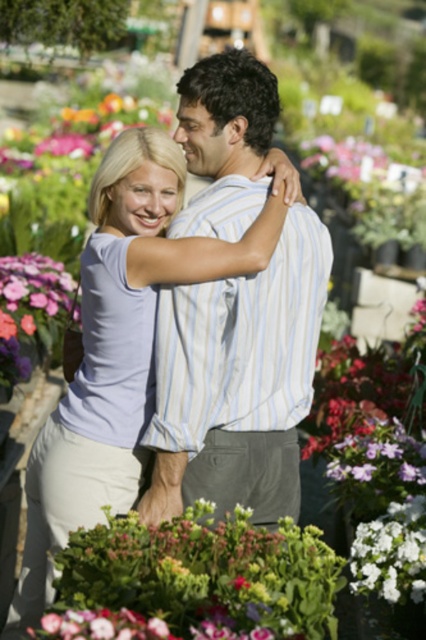
Question: Which object is closer to the camera taking this photo?

Choices:
 (A) light purple cotton shirt at center
 (B) green leafy plant at center
 (C) pink matte flower at center
 (D) white matte flower at center

Answer: (C)

Question: Which of the following is the farthest from the observer?

Choices:
 (A) (373, 580)
 (B) (221, 243)
 (C) (310, 307)
 (D) (149, 618)

Answer: (C)

Question: Considering the relative positions of striped cotton shirt at center and pink matte flower at lower left in the image provided, where is striped cotton shirt at center located with respect to pink matte flower at lower left?

Choices:
 (A) above
 (B) below

Answer: (A)

Question: From the image, what is the correct spatial relationship of striped cotton shirt at center in relation to pink matte flower at lower left?

Choices:
 (A) left
 (B) right

Answer: (B)

Question: Which of the following is the farthest from the observer?

Choices:
 (A) (140, 280)
 (B) (48, 330)

Answer: (B)

Question: Does pink matte flower at lower left appear on the left side of pink matte flower at center?

Choices:
 (A) no
 (B) yes

Answer: (B)